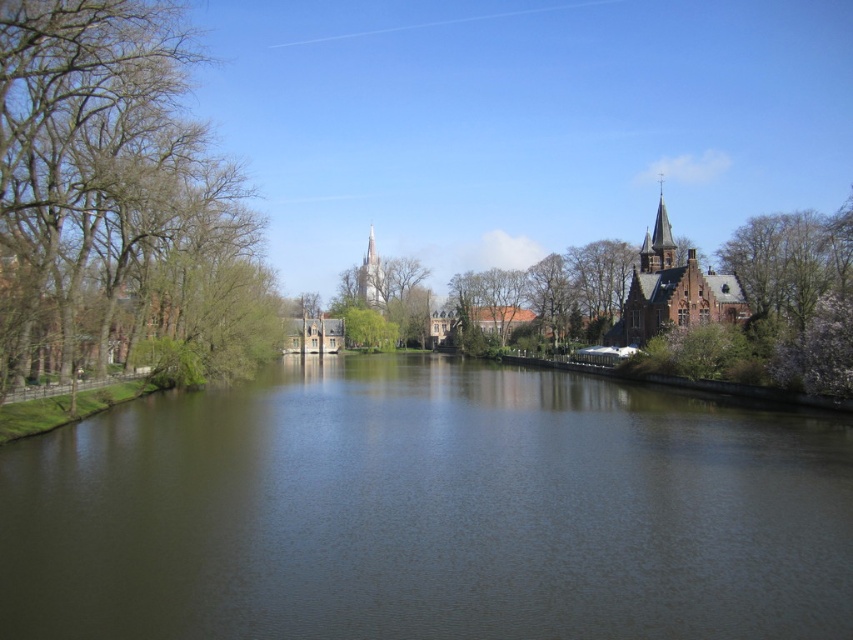
Is green leafy tree at left smaller than brown brick church at upper right?

No.

Which is in front, point (33, 97) or point (714, 285)?

Positioned in front is point (33, 97).

Is point (117, 124) positioned in front of point (685, 262)?

Yes, point (117, 124) is in front of point (685, 262).

Locate an element on the screen. This screenshot has height=640, width=853. green leafy tree at left is located at coordinates (113, 196).

Is cherry blossom tree at right above brown brick church at upper right?

Yes.

At what (x,y) coordinates should I click in order to perform the action: click on cherry blossom tree at right. Please return your answer as a coordinate pair (x, y). The width and height of the screenshot is (853, 640). Looking at the image, I should click on (799, 292).

Is greenish water at center below green leafy tree at left?

Indeed, greenish water at center is positioned under green leafy tree at left.

Does greenish water at center have a greater width compared to green leafy tree at left?

→ Indeed, greenish water at center has a greater width compared to green leafy tree at left.

This screenshot has height=640, width=853. What do you see at coordinates (428, 512) in the screenshot?
I see `greenish water at center` at bounding box center [428, 512].

Locate an element on the screen. greenish water at center is located at coordinates point(428,512).